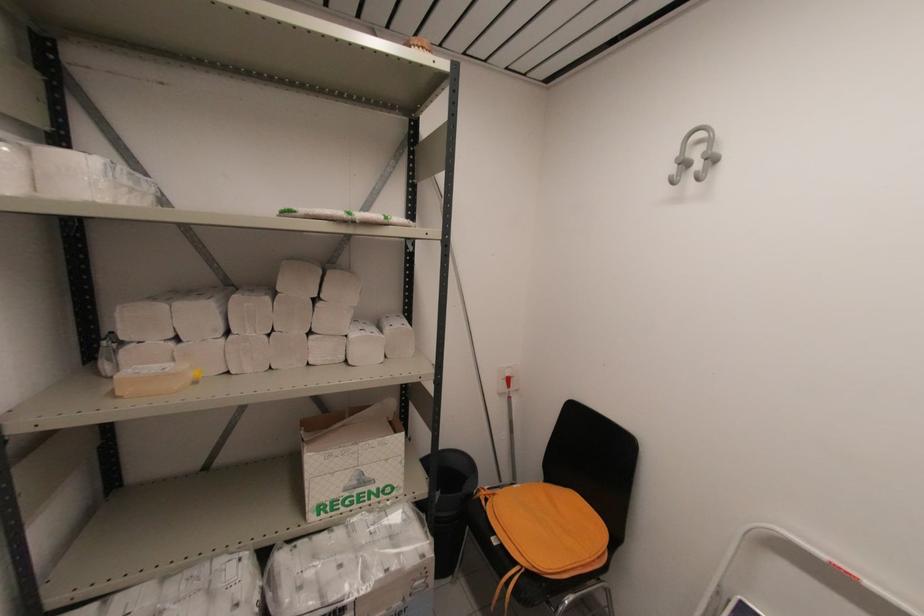
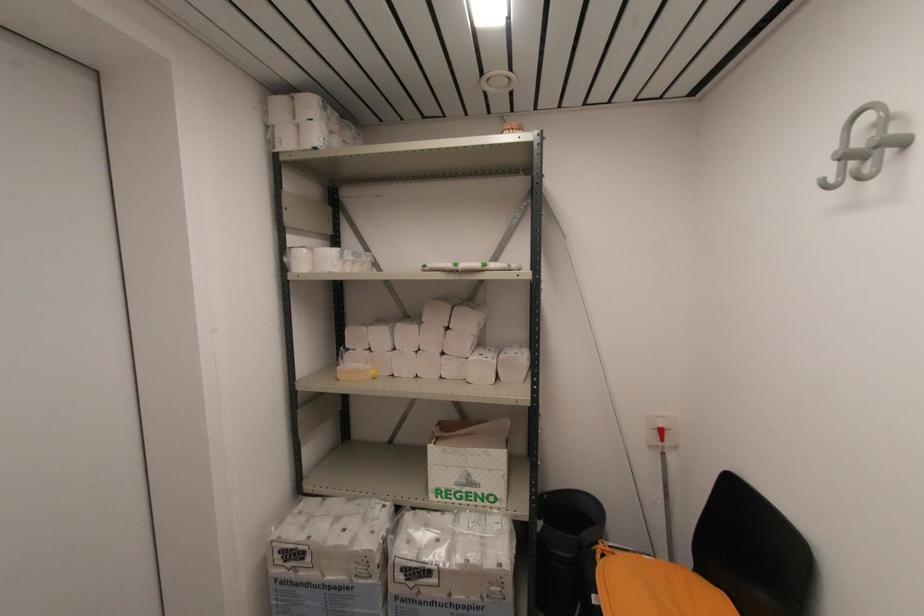
Question: I am providing you with two images of the same scene from different viewpoints. After the viewpoint changes to image2, which objects are now occluded?

Choices:
 (A) white cardboard box
 (B) black trash can
 (C) paper towel package
 (D) none of these

Answer: (D)